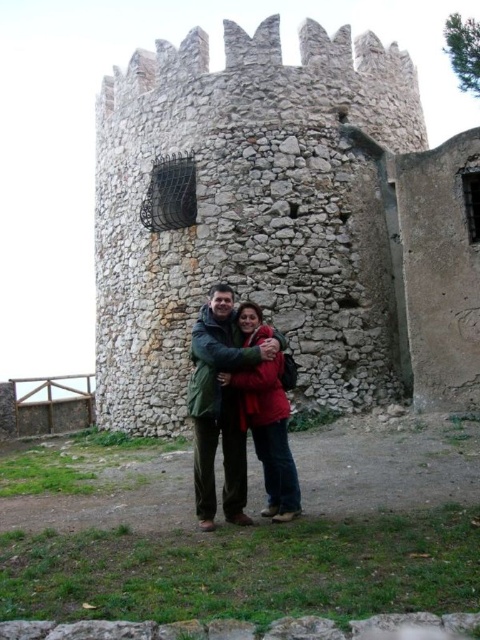
Is stone wall at center shorter than green wool coat at center?

In fact, stone wall at center may be taller than green wool coat at center.

What do you see at coordinates (282, 221) in the screenshot? I see `stone wall at center` at bounding box center [282, 221].

The width and height of the screenshot is (480, 640). What are the coordinates of `stone wall at center` in the screenshot? It's located at (282, 221).